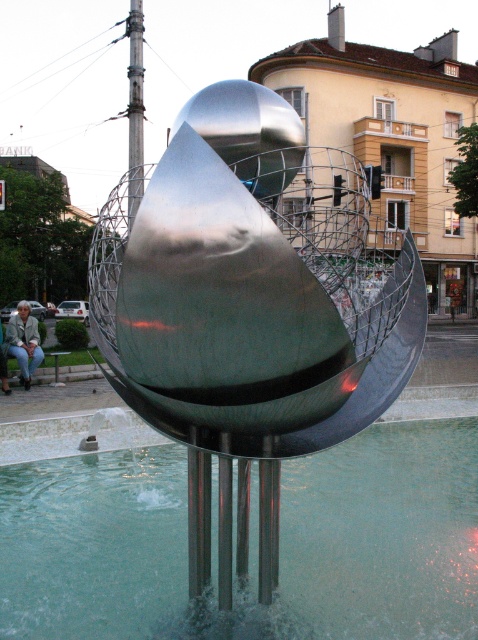
Is point (205, 444) behind point (409, 460)?

No.

Does polished metal sculpture at center appear on the right side of clear water at fountain center?

Yes, polished metal sculpture at center is to the right of clear water at fountain center.

Which is in front, point (325, 301) or point (178, 525)?

Point (325, 301) is more forward.

Where is `polished metal sculpture at center`? The height and width of the screenshot is (640, 478). polished metal sculpture at center is located at coordinates (250, 308).

Does polished metal sculpture at center appear under denim jacket at lower left?

Actually, polished metal sculpture at center is above denim jacket at lower left.

Which is behind, point (220, 561) or point (10, 324)?

Point (10, 324)

Which is behind, point (199, 308) or point (20, 332)?

Point (20, 332)

The image size is (478, 640). Identify the location of polished metal sculpture at center. pyautogui.click(x=250, y=308).

Between point (397, 624) and point (31, 333), which one is positioned behind?

The point (31, 333) is behind.

Can you confirm if clear water at fountain center is thinner than denim jacket at lower left?

No.

Image resolution: width=478 pixels, height=640 pixels. I want to click on clear water at fountain center, so click(250, 544).